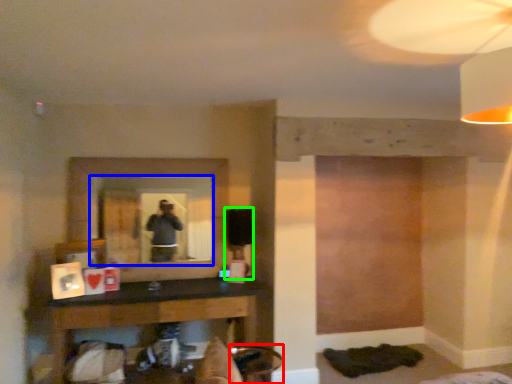
Question: Considering the real-world distances, which object is closest to swivel chair (highlighted by a red box)? mirror (highlighted by a blue box) or table lamp (highlighted by a green box).

Choices:
 (A) mirror
 (B) table lamp

Answer: (B)